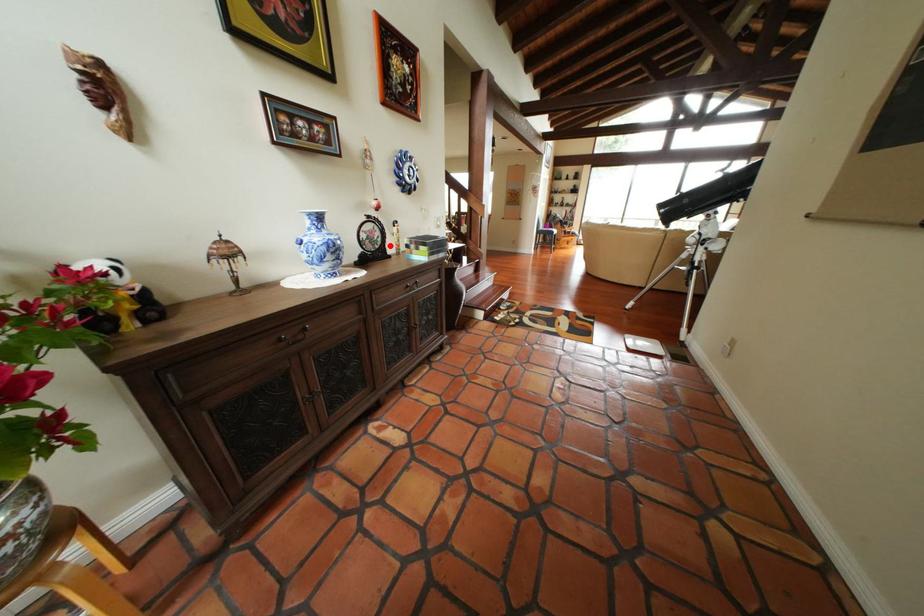
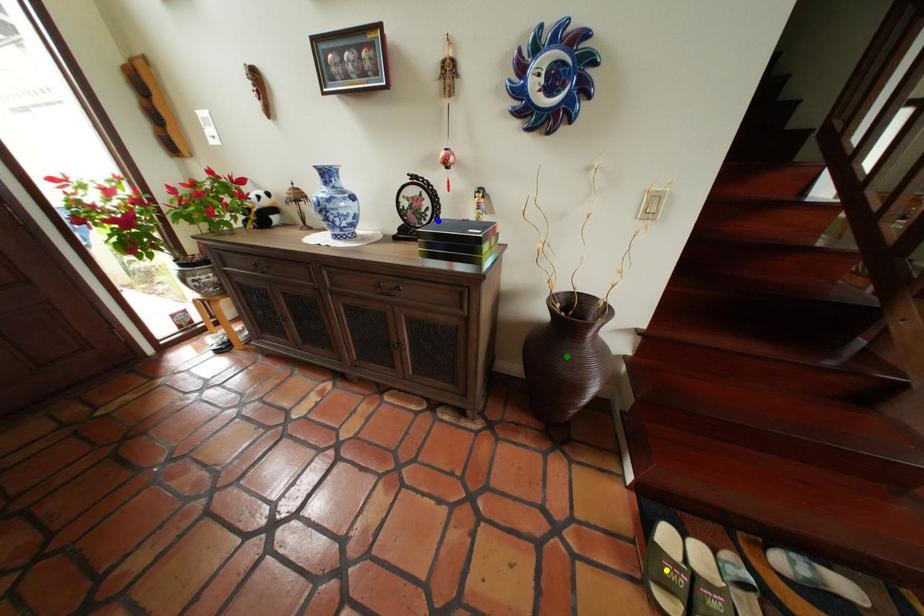
Question: I am providing you with two images of the same scene from different viewpoints. A red point is marked on the first image. You are given multiple points on the second image. Which point in image 2 represents the same 3d spot as the red point in image 1?

Choices:
 (A) yellow point
 (B) green point
 (C) blue point

Answer: (C)